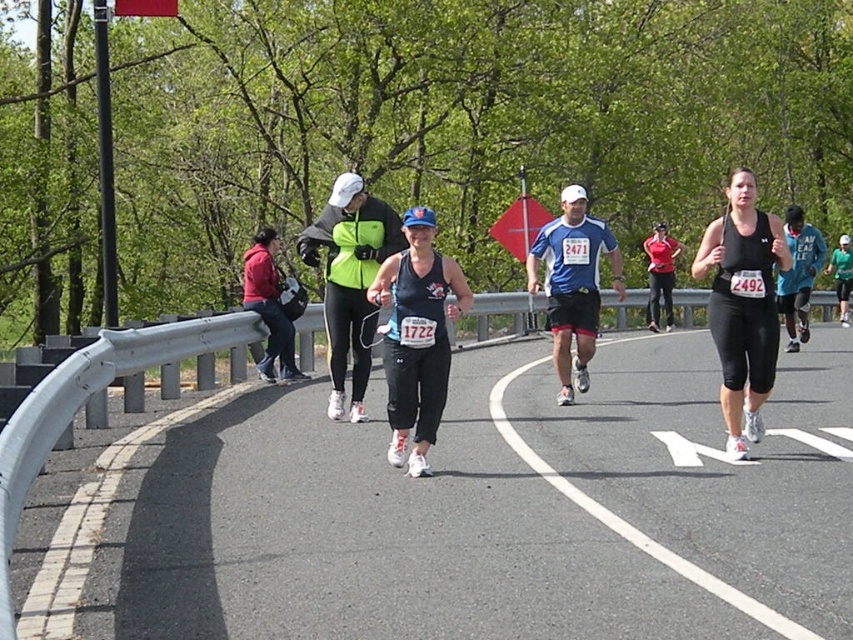
Is black matte tank top at center smaller than teal fabric shirt at right?

Yes.

Looking at this image, between black matte tank top at center and teal fabric shirt at right, which one is positioned higher?

teal fabric shirt at right is above.

What do you see at coordinates (741, 305) in the screenshot? The height and width of the screenshot is (640, 853). I see `black matte tank top at center` at bounding box center [741, 305].

I want to click on black matte tank top at center, so click(741, 305).

Can you confirm if matte black tank top at center is smaller than teal fabric shirt at right?

No.

Does point (444, 333) come farther from viewer compared to point (785, 228)?

No, (444, 333) is in front of (785, 228).

Locate an element on the screen. The image size is (853, 640). matte black tank top at center is located at coordinates (416, 337).

Describe the element at coordinates (416, 337) in the screenshot. I see `matte black tank top at center` at that location.

Is matte black tank top at center positioned before matte red tank top at center?

Yes, it is in front of matte red tank top at center.

Is point (399, 385) farther from camera compared to point (653, 305)?

That is False.

This screenshot has height=640, width=853. I want to click on matte black tank top at center, so click(416, 337).